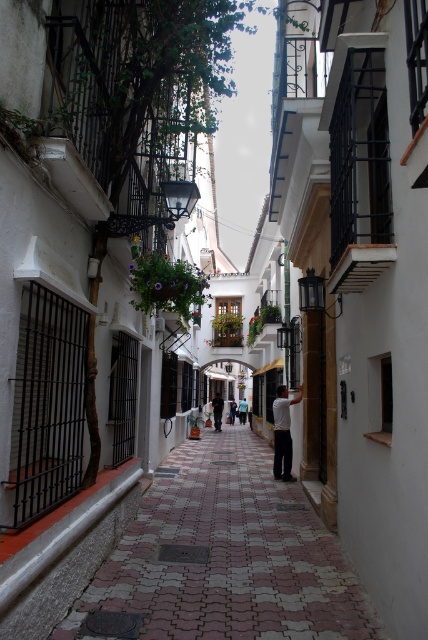
You are standing on the pebble stone pavement at center and want to walk towards the light blue shirt at center. Which direction should you move?

You should move backward because the pebble stone pavement at center is in front of the light blue shirt at center, meaning the shirt is behind you relative to your current position on the pavement.

You are standing at the entrance of the narrow street and want to walk to the pebble stone pavement at center. According to the coordinates provided, where should you head?

The pebble stone pavement at center is located at coordinates point (223, 557), so you should head towards that point to reach it.

You are a tourist walking down the narrow street in the image. You notice the pebble stone pavement at center and the light blue shirt at center. Which object is wider?

The pebble stone pavement at center is wider than the light blue shirt at center according to the description.